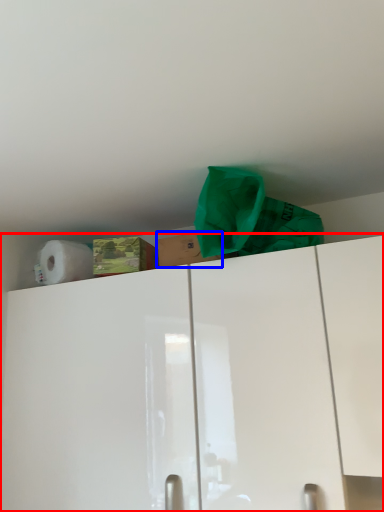
Question: Which point is closer to the camera, cabinetry (highlighted by a red box) or cardboard box (highlighted by a blue box)?

Choices:
 (A) cabinetry
 (B) cardboard box

Answer: (A)